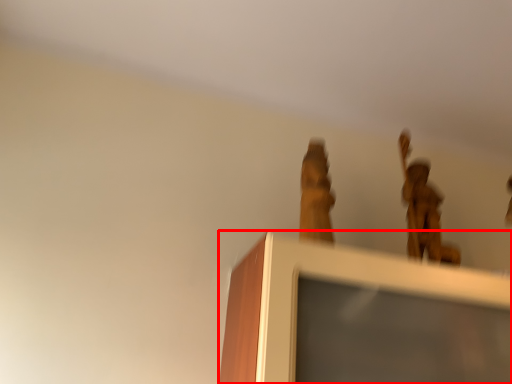
Question: Considering the relative positions of furniture (annotated by the red box) and bronze statue in the image provided, where is furniture (annotated by the red box) located with respect to the staircase?

Choices:
 (A) left
 (B) right

Answer: (A)